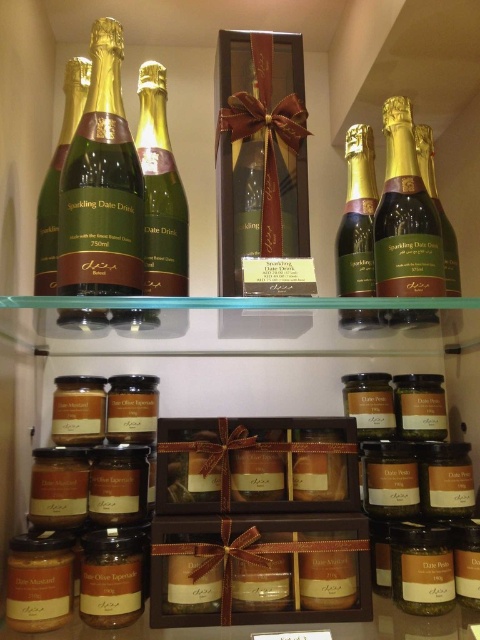
You are a delivery person who needs to place a new item between the matte gold bottle at center and the matte brown jar at center on the shelf. The item you are delivering is 20 centimeters wide. Can you fit it between them?

The matte gold bottle at center and matte brown jar at center are 46.05 centimeters apart from each other. Since the item you need to place is 20 centimeters wide, there is enough space between them to fit the item.

You are a delivery person who needs to place a new matte gold champagne bottle at left on the top shelf. The existing one is 23.35 inches away from the camera. If your arm can reach up to 25 inches, can you safely place the new bottle without overreaching?

The existing matte gold champagne bottle at left is 23.35 inches away from the camera. Since your arm can reach up to 25 inches, you can safely place the new bottle without overreaching.

You are a customer at the store and want to grab both the matte gold bottle at right and the matte brown jar at center. Which one is easier to reach without moving any other items?

The matte gold bottle at right is positioned over the matte brown jar at center, so it is higher and might be easier to reach without moving other items.